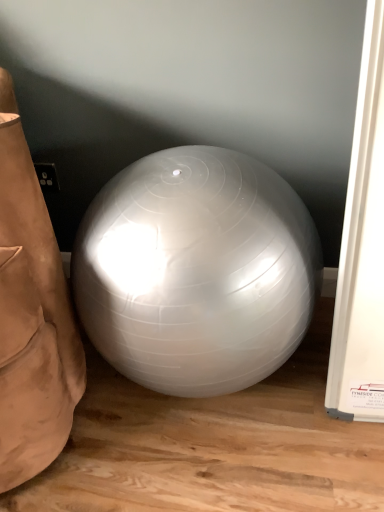
What do you see at coordinates (196, 271) in the screenshot? The width and height of the screenshot is (384, 512). I see `glossy white ball at center` at bounding box center [196, 271].

The height and width of the screenshot is (512, 384). In order to click on glossy white ball at center in this screenshot , I will do `click(196, 271)`.

This screenshot has width=384, height=512. I want to click on glossy white ball at center, so click(x=196, y=271).